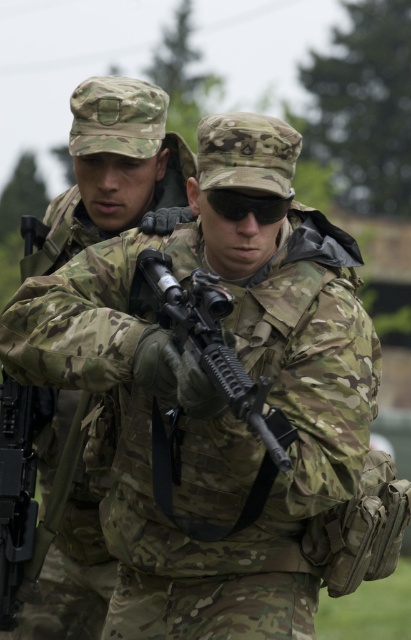
Does camo uniform at center have a greater height compared to matte black rifle at center?

Correct, camo uniform at center is much taller as matte black rifle at center.

Which is in front, point (36, 612) or point (189, 317)?

Point (189, 317) is in front.

Image resolution: width=411 pixels, height=640 pixels. What do you see at coordinates (115, 170) in the screenshot?
I see `camo uniform at center` at bounding box center [115, 170].

The image size is (411, 640). What are the coordinates of `camo uniform at center` in the screenshot? It's located at (115, 170).